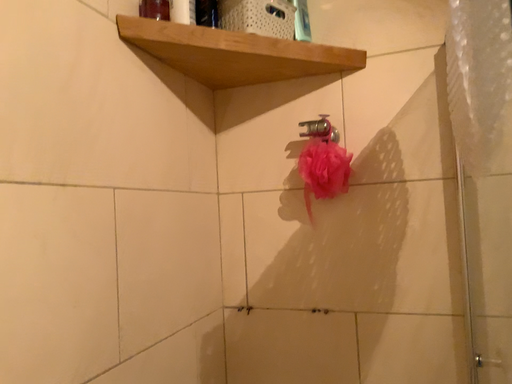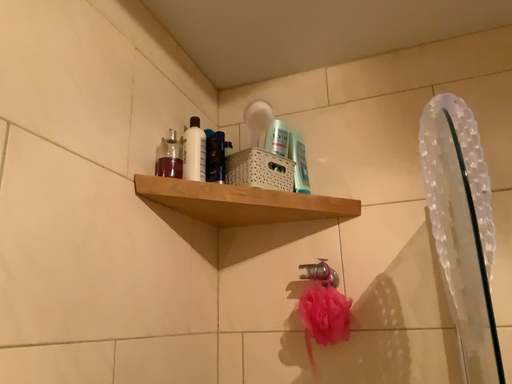
Question: Which way did the camera rotate in the video?

Choices:
 (A) rotated downward
 (B) rotated upward

Answer: (B)